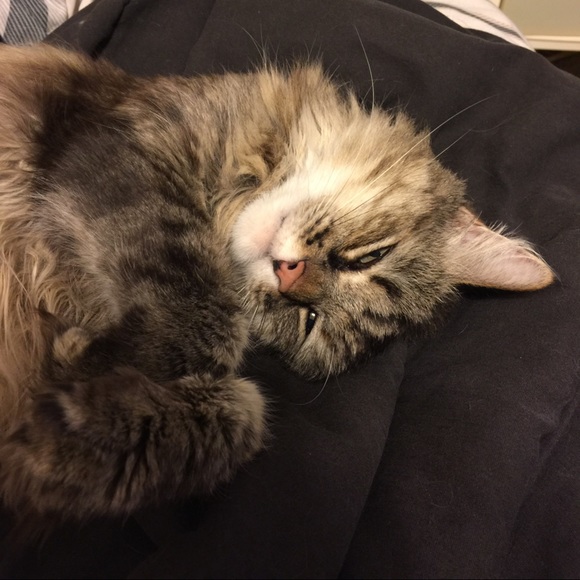
Image resolution: width=580 pixels, height=580 pixels. I want to click on blanket, so click(x=170, y=37), click(x=518, y=358), click(x=451, y=461), click(x=275, y=527).